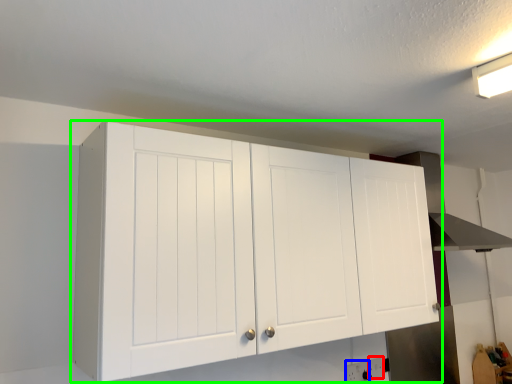
Question: Based on their relative distances, which object is farther from electric outlet (highlighted by a red box)? Choose from electric outlet (highlighted by a blue box) and cupboard (highlighted by a green box).

Choices:
 (A) electric outlet
 (B) cupboard

Answer: (B)